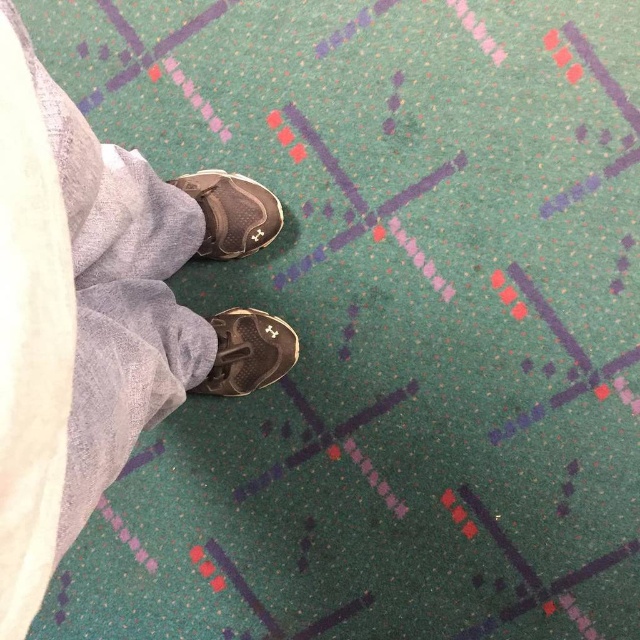
Based on the photo, you are designing a shoe display stand and need to place both the matte gray sneaker at center and the matte black sneaker at center side by side. Given their widths, which sneaker requires more horizontal space on the stand?

The matte gray sneaker at center requires more horizontal space because its width is larger than the matte black sneaker at center.

You are designing a new app that helps users identify clothing items in photos. The app needs to determine which item is bigger between the matte gray pants at center and the matte black sneaker at center. Based on the scene, which item is larger?

The matte gray pants at center is larger in size than the matte black sneaker at center.

You are looking down at your feet and see the matte gray sneaker at center and the matte black sneaker at center. Which one is closer to your eyes?

The matte gray sneaker at center is closer to your eyes because it is above the matte black sneaker at center.